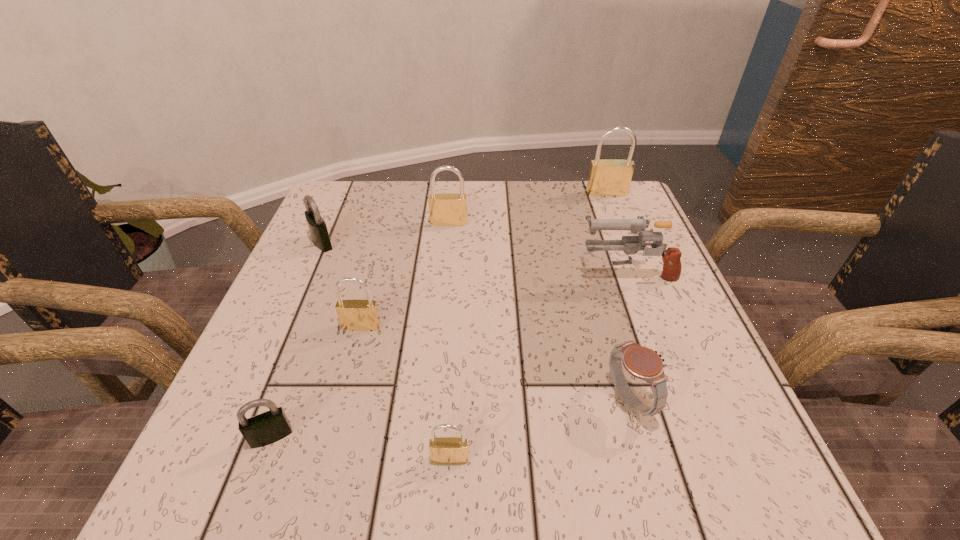
I want to click on the farthest brass padlock, so click(x=611, y=177).

You are a GUI agent. You are given a task and a screenshot of the screen. Output one action in this format:
    pyautogui.click(x=<x>, y=<y>)
    Task: Click on the farthest object
    
    Given the screenshot: What is the action you would take?
    pyautogui.click(x=611, y=177)

What are the coordinates of `the third nearest brass padlock` in the screenshot? It's located at (446, 209).

The width and height of the screenshot is (960, 540). I want to click on the second farthest padlock, so click(446, 209).

The width and height of the screenshot is (960, 540). Find the location of `the fifth nearest object`. the fifth nearest object is located at coordinates (671, 272).

Locate an element on the screen. The width and height of the screenshot is (960, 540). the sixth nearest object is located at coordinates 317,226.

The width and height of the screenshot is (960, 540). I want to click on the bigger black padlock, so click(317, 226).

Locate an element on the screen. This screenshot has height=540, width=960. the fourth farthest padlock is located at coordinates (354, 315).

Find the location of a particular element. the third padlock from left to right is located at coordinates (354, 315).

Identify the location of watch. The height and width of the screenshot is (540, 960). (641, 362).